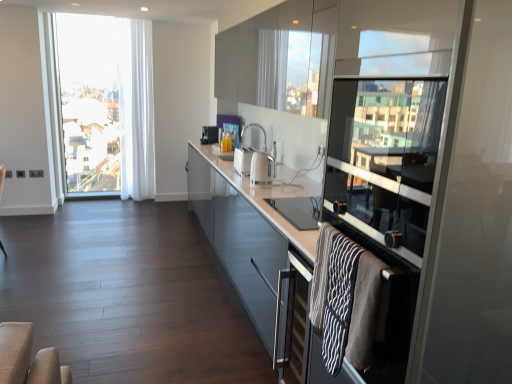
Question: Can you confirm if satin silver toaster at center, the 3th appliance when ordered from front to back, is thinner than transparent glass screen door at right?

Choices:
 (A) yes
 (B) no

Answer: (A)

Question: Considering the relative sizes of satin silver toaster at center, the 3th appliance when ordered from front to back, and transparent glass screen door at right in the image provided, is satin silver toaster at center, the 3th appliance when ordered from front to back, shorter than transparent glass screen door at right?

Choices:
 (A) no
 (B) yes

Answer: (B)

Question: Considering the relative positions of satin silver toaster at center, the 3th appliance ordered from the bottom, and transparent glass screen door at right in the image provided, is satin silver toaster at center, the 3th appliance ordered from the bottom, to the right of transparent glass screen door at right from the viewer's perspective?

Choices:
 (A) no
 (B) yes

Answer: (A)

Question: Is the position of satin silver toaster at center, the 3th appliance when ordered from front to back, less distant than that of transparent glass screen door at right?

Choices:
 (A) no
 (B) yes

Answer: (A)

Question: Is satin silver toaster at center, which appears as the first appliance when viewed from the top, further to camera compared to transparent glass screen door at right?

Choices:
 (A) yes
 (B) no

Answer: (A)

Question: In terms of size, does transparent glass window screen at right appear bigger or smaller than white glossy electric kettle at center, the 3th appliance positioned from the left?

Choices:
 (A) small
 (B) big

Answer: (B)

Question: Considering their positions, is transparent glass window screen at right located in front of or behind white glossy electric kettle at center, arranged as the 3th appliance when viewed from the top?

Choices:
 (A) front
 (B) behind

Answer: (A)

Question: From the image's perspective, is transparent glass window screen at right located above or below white glossy electric kettle at center, the 3th appliance positioned from the left?

Choices:
 (A) below
 (B) above

Answer: (B)

Question: Visually, is transparent glass window screen at right positioned to the left or to the right of white glossy electric kettle at center, the 3th appliance positioned from the left?

Choices:
 (A) right
 (B) left

Answer: (A)

Question: Is point [150, 139] closer or farther from the camera than point [412, 216]?

Choices:
 (A) farther
 (B) closer

Answer: (A)

Question: In terms of width, does clear glass window at left look wider or thinner when compared to transparent glass screen door at right?

Choices:
 (A) thin
 (B) wide

Answer: (A)

Question: From their relative heights in the image, would you say clear glass window at left is taller or shorter than transparent glass screen door at right?

Choices:
 (A) short
 (B) tall

Answer: (B)

Question: From a real-world perspective, relative to transparent glass screen door at right, is clear glass window at left vertically above or below?

Choices:
 (A) below
 (B) above

Answer: (B)

Question: Is white glossy electric kettle at center, the 1th appliance viewed from the right, bigger or smaller than glossy glass cabinets at upper center, which is the 2th cabinetry in bottom-to-top order?

Choices:
 (A) big
 (B) small

Answer: (B)

Question: In terms of width, does white glossy electric kettle at center, arranged as the 3th appliance when viewed from the top, look wider or thinner when compared to glossy glass cabinets at upper center, which is the 2th cabinetry in bottom-to-top order?

Choices:
 (A) wide
 (B) thin

Answer: (B)